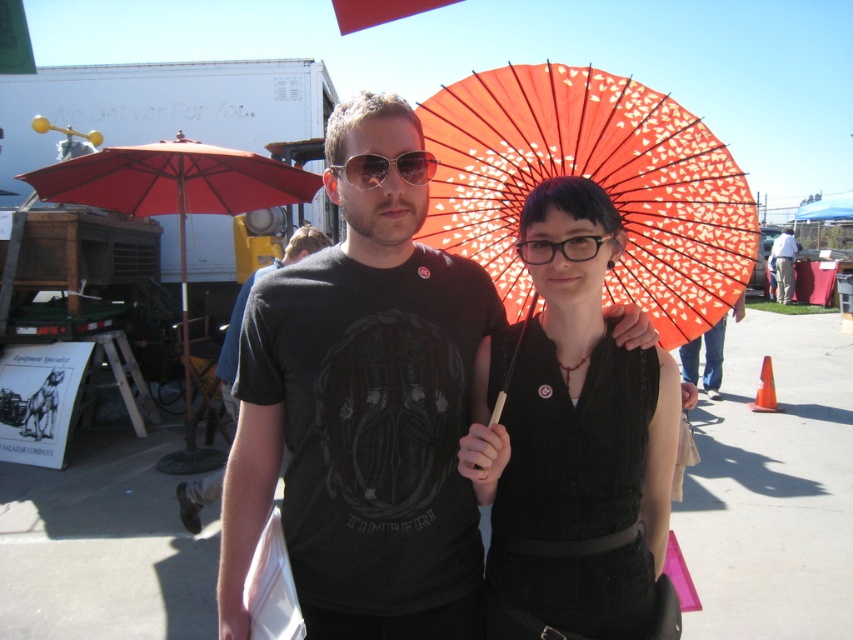
You are standing at the center of the scene and want to move towards the red fabric umbrella at left. Which direction should you face to walk directly towards it?

The red fabric umbrella at left is located at point 0.333 on the x and 0.206 on the y, so you should face towards the left side of the scene to walk directly towards it.

You are standing at the point with coordinates point (175, 212). Which object are you touching?

The point (175, 212) is on the red fabric umbrella at left.